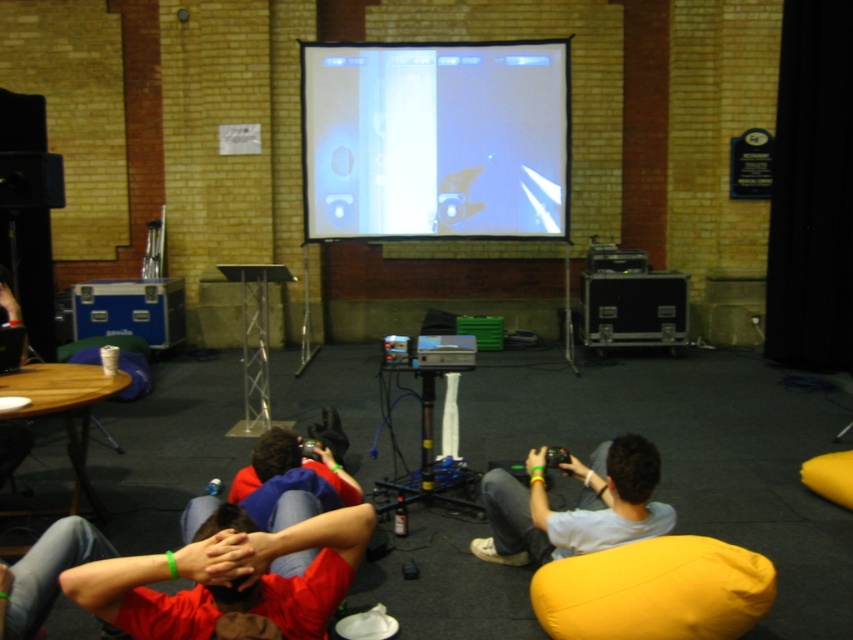
From the picture: Can you confirm if red fabric shirt at center is wider than light gray fabric shirt at center?

Yes.

Find the location of a particular element. This screenshot has height=640, width=853. red fabric shirt at center is located at coordinates click(229, 579).

Between point (244, 541) and point (584, 532), which one is positioned behind?

Point (584, 532)

Find the location of a particular element. The image size is (853, 640). red fabric shirt at center is located at coordinates (229, 579).

Does white glossy projection screen at upper center have a lesser width compared to red fabric shirt at center?

In fact, white glossy projection screen at upper center might be wider than red fabric shirt at center.

Is white glossy projection screen at upper center positioned behind red fabric shirt at center?

Yes, white glossy projection screen at upper center is further from the viewer.

Is point (335, 173) positioned after point (122, 611)?

Yes, point (335, 173) is farther from viewer.

Locate an element on the screen. The width and height of the screenshot is (853, 640). white glossy projection screen at upper center is located at coordinates (434, 140).

This screenshot has width=853, height=640. I want to click on yellow fabric bean bag at lower right, so click(654, 589).

Find the location of a particular element. The image size is (853, 640). yellow fabric bean bag at lower right is located at coordinates (654, 589).